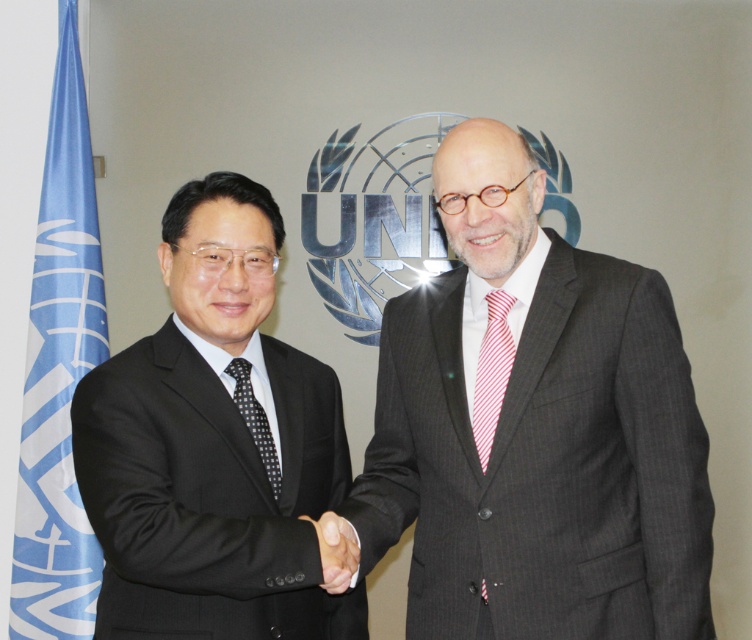
Question: Estimate the real-world distances between objects in this image. Which object is farther from the red striped tie at right?

Choices:
 (A) black matte suit at left
 (B) black dotted tie at center
 (C) gray pinstripe suit at center
 (D) blue fabric flag at left

Answer: (D)

Question: Which object appears farthest from the camera in this image?

Choices:
 (A) blue fabric flag at left
 (B) black matte suit at left

Answer: (A)

Question: Is blue fabric flag at left bigger than black matte hand at center?

Choices:
 (A) no
 (B) yes

Answer: (B)

Question: Based on their relative distances, which object is farther from the black dotted tie at center?

Choices:
 (A) blue fabric flag at left
 (B) gray pinstripe suit at center
 (C) black matte hand at center
 (D) red striped tie at right

Answer: (A)

Question: Does blue fabric flag at left have a lesser width compared to black dotted tie at center?

Choices:
 (A) no
 (B) yes

Answer: (A)

Question: Is gray pinstripe suit at center thinner than black dotted tie at center?

Choices:
 (A) yes
 (B) no

Answer: (B)